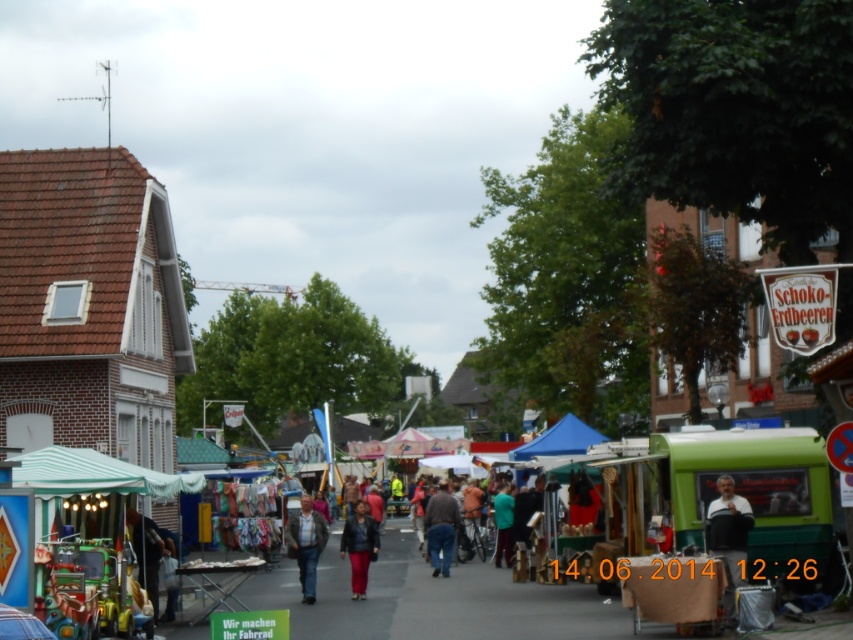
Question: Which point appears farthest from the camera in this image?

Choices:
 (A) (561, 435)
 (B) (440, 490)

Answer: (A)

Question: Which object appears farthest from the camera in this image?

Choices:
 (A) denim jacket at center
 (B) green fabric stall at center

Answer: (A)

Question: Does green fabric stall at center have a greater width compared to green fabric jacket at center?

Choices:
 (A) no
 (B) yes

Answer: (B)

Question: Which of the following is the closest to the observer?

Choices:
 (A) dark gray sweater at center
 (B) dark brown leather jacket at center
 (C) matte black jacket at center
 (D) denim jacket at center

Answer: (A)

Question: Does green fabric stall at center come behind denim jacket at center?

Choices:
 (A) no
 (B) yes

Answer: (A)

Question: Is blue fabric canopy at center behind green fabric jacket at center?

Choices:
 (A) yes
 (B) no

Answer: (B)